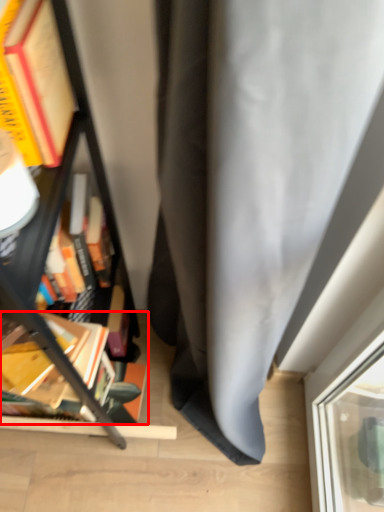
Question: From the image's perspective, what is the correct spatial relationship of book (annotated by the red box) in relation to bookcase?

Choices:
 (A) above
 (B) below

Answer: (B)